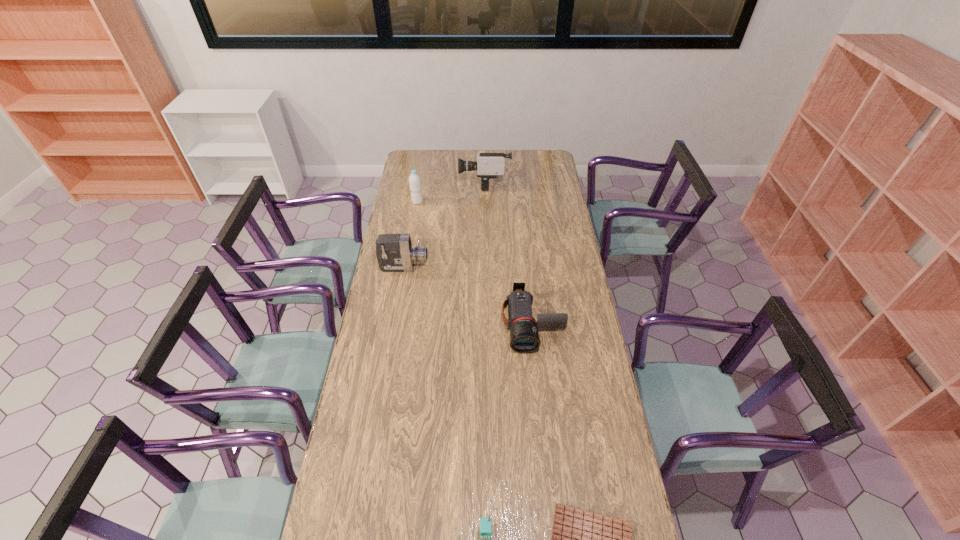
Find the location of a particular element. This screenshot has width=960, height=540. the farthest object is located at coordinates (489, 165).

I want to click on the farthest camcorder, so click(x=489, y=165).

You are a GUI agent. You are given a task and a screenshot of the screen. Output one action in this format:
    pyautogui.click(x=<x>, y=<y>)
    Task: Click on the fifth nearest object
    This screenshot has width=960, height=540.
    Given the screenshot: What is the action you would take?
    (x=414, y=179)

Where is `the second shortest camcorder`? The height and width of the screenshot is (540, 960). the second shortest camcorder is located at coordinates (394, 252).

Find the location of a particular element. the second nearest camcorder is located at coordinates (394, 252).

At what (x,y) coordinates should I click in order to perform the action: click on the shortest camcorder. Please return your answer as a coordinate pair (x, y). Looking at the image, I should click on (524, 336).

What are the coordinates of `the nearest camcorder` in the screenshot? It's located at (524, 336).

Identify the location of vacant point located 0.270m on the recording direction of the farthest object. This screenshot has height=540, width=960. 413,183.

Locate an element on the screen. vacant region located 0.050m on the recording direction of the farthest object is located at coordinates (451, 183).

Where is `vacant space located on the recording direction of the farthest object`? vacant space located on the recording direction of the farthest object is located at coordinates (418, 183).